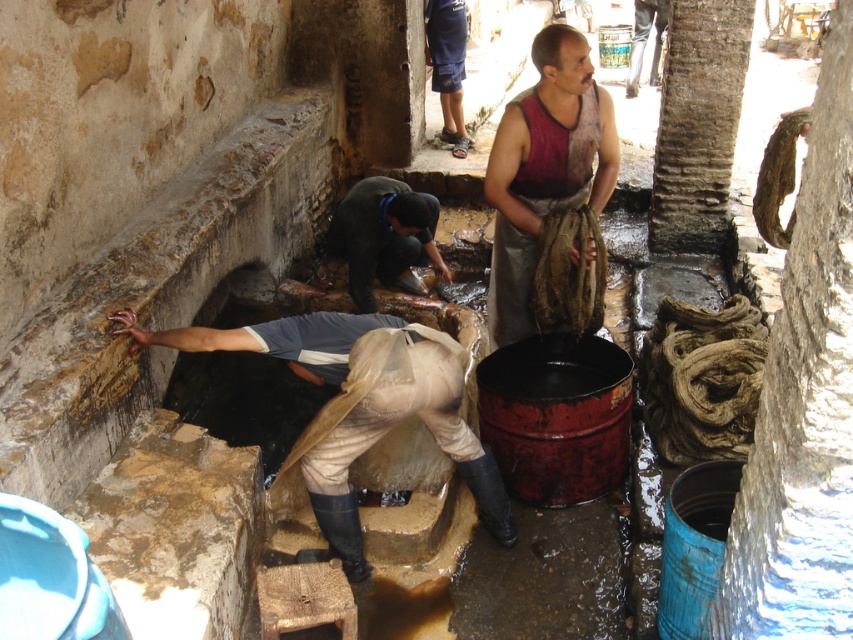
Does light brown leather boots at lower center have a greater height compared to dark red sleeveless shirt at center?

No, light brown leather boots at lower center is not taller than dark red sleeveless shirt at center.

Between light brown leather boots at lower center and dark red sleeveless shirt at center, which one is positioned lower?

light brown leather boots at lower center is below.

Between point (314, 342) and point (502, 276), which one is positioned in front?

Point (314, 342) is more forward.

Locate an element on the screen. This screenshot has height=640, width=853. light brown leather boots at lower center is located at coordinates (358, 410).

Is light brown leather boots at lower center to the right of dark gray fabric at lower center from the viewer's perspective?

Incorrect, light brown leather boots at lower center is not on the right side of dark gray fabric at lower center.

Does point (352, 525) come behind point (395, 209)?

No, it is in front of (395, 209).

Locate an element on the screen. light brown leather boots at lower center is located at coordinates (358, 410).

Is light brown leather boots at lower center smaller than dark blue denim shorts at center?

Incorrect, light brown leather boots at lower center is not smaller in size than dark blue denim shorts at center.

Identify the location of light brown leather boots at lower center. (358, 410).

Who is more forward, (x=260, y=353) or (x=457, y=140)?

Point (x=260, y=353) is in front.

Where is `light brown leather boots at lower center`? Image resolution: width=853 pixels, height=640 pixels. light brown leather boots at lower center is located at coordinates (358, 410).